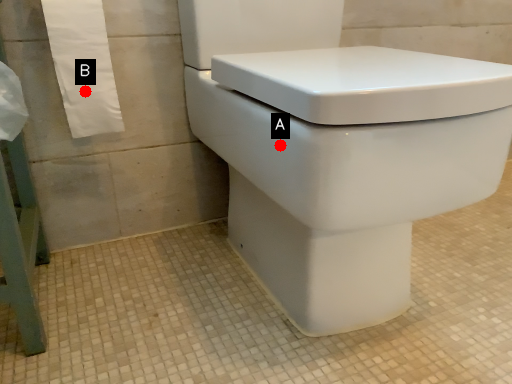
Question: Two points are circled on the image, labeled by A and B beside each circle. Which point appears farthest from the camera in this image?

Choices:
 (A) A is further
 (B) B is further

Answer: (B)